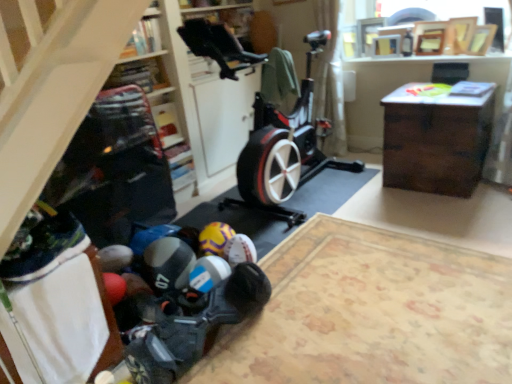
Question: Considering the relative sizes of wooden cabinet at center and wooden bookshelf at upper center, placed as the second shelf when sorted from back to front, in the image provided, is wooden cabinet at center smaller than wooden bookshelf at upper center, placed as the second shelf when sorted from back to front,?

Choices:
 (A) yes
 (B) no

Answer: (B)

Question: From the image's perspective, is wooden cabinet at center beneath wooden bookshelf at upper center, the 1th shelf in the front-to-back sequence?

Choices:
 (A) yes
 (B) no

Answer: (A)

Question: From a real-world perspective, is wooden cabinet at center located higher than wooden bookshelf at upper center, the 1th shelf in the front-to-back sequence?

Choices:
 (A) no
 (B) yes

Answer: (A)

Question: Are wooden cabinet at center and wooden bookshelf at upper center, the 1th shelf from the top, located far from each other?

Choices:
 (A) no
 (B) yes

Answer: (B)

Question: From the image's perspective, is wooden cabinet at center located above wooden bookshelf at upper center, acting as the second shelf starting from the bottom?

Choices:
 (A) no
 (B) yes

Answer: (A)

Question: Is point (324, 6) closer or farther from the camera than point (170, 137)?

Choices:
 (A) closer
 (B) farther

Answer: (B)

Question: Considering the positions of white sheer curtain at upper center and matte plastic shelf at upper center, arranged as the first shelf when ordered from the bottom, in the image, is white sheer curtain at upper center taller or shorter than matte plastic shelf at upper center, arranged as the first shelf when ordered from the bottom,?

Choices:
 (A) short
 (B) tall

Answer: (B)

Question: Would you say white sheer curtain at upper center is to the left or to the right of matte plastic shelf at upper center, arranged as the first shelf when ordered from the bottom, in the picture?

Choices:
 (A) right
 (B) left

Answer: (A)

Question: Is white sheer curtain at upper center inside the boundaries of matte plastic shelf at upper center, which is the 1th shelf from back to front, or outside?

Choices:
 (A) outside
 (B) inside

Answer: (A)

Question: Is point (221, 243) positioned closer to the camera than point (141, 256)?

Choices:
 (A) farther
 (B) closer

Answer: (A)

Question: In the image, is yellow matte soccer ball at lower center, which is counted as the 2th toy, starting from the front, positioned in front of or behind rubberized plastic toy at lower center, marked as the second toy in a back-to-front arrangement?

Choices:
 (A) front
 (B) behind

Answer: (B)

Question: From a real-world perspective, is yellow matte soccer ball at lower center, the 1th toy when ordered from back to front, positioned above or below rubberized plastic toy at lower center, marked as the second toy in a back-to-front arrangement?

Choices:
 (A) below
 (B) above

Answer: (A)

Question: In terms of size, does yellow matte soccer ball at lower center, the 1th toy when ordered from back to front, appear bigger or smaller than rubberized plastic toy at lower center, the first toy when ordered from front to back?

Choices:
 (A) small
 (B) big

Answer: (A)

Question: From their relative heights in the image, would you say yellow matte soccer ball at lower center, the 1th toy when ordered from back to front, is taller or shorter than white sheer curtain at upper center?

Choices:
 (A) tall
 (B) short

Answer: (B)

Question: Visually, is yellow matte soccer ball at lower center, the 1th toy when ordered from back to front, positioned to the left or to the right of white sheer curtain at upper center?

Choices:
 (A) left
 (B) right

Answer: (A)